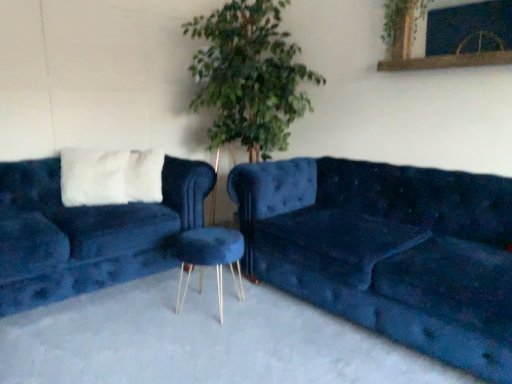
Where is `free space between velvet blue couch at left, acting as the second studio couch starting from the right, and velvet blue stool at center`? The width and height of the screenshot is (512, 384). free space between velvet blue couch at left, acting as the second studio couch starting from the right, and velvet blue stool at center is located at coordinates (133, 312).